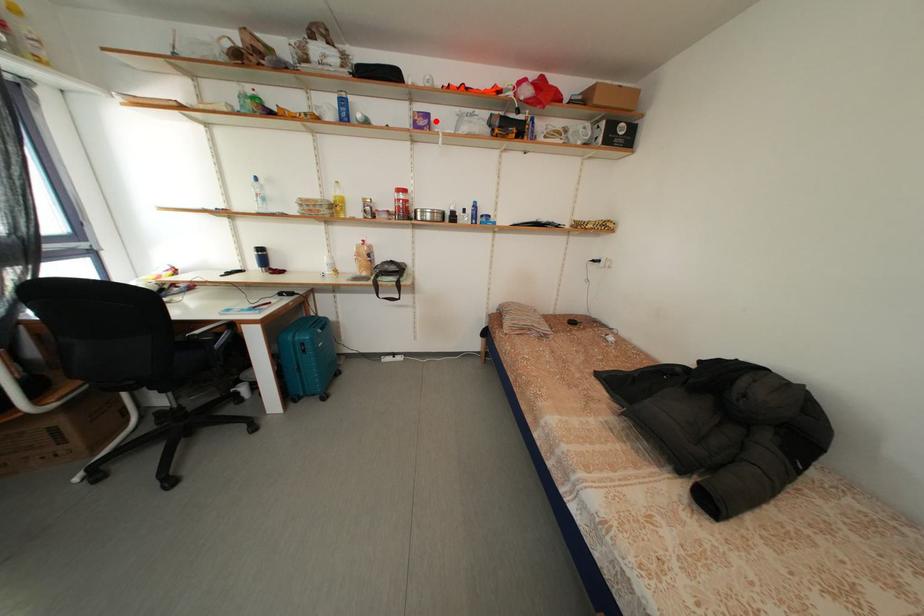
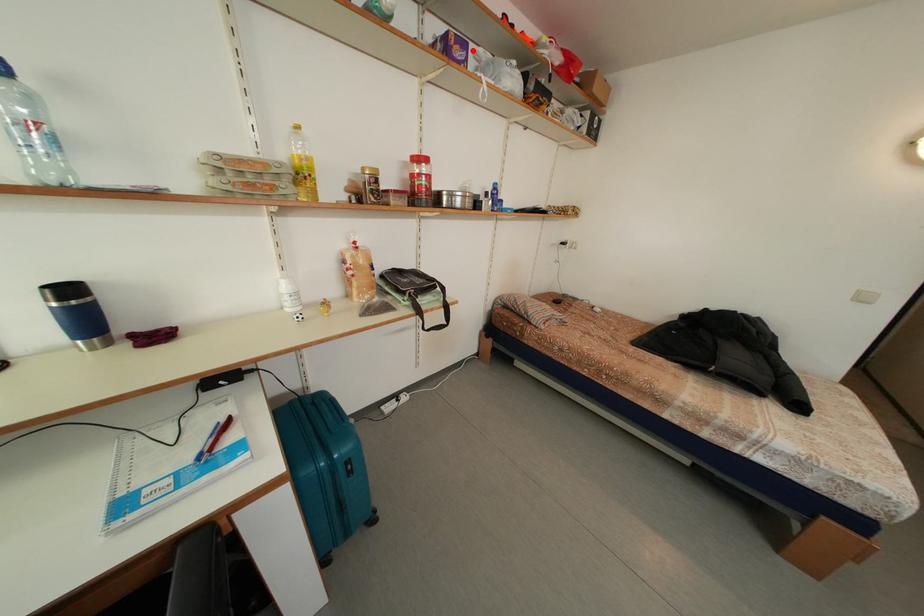
I am providing you with two images of the same scene from different viewpoints. A red point is marked on the first image and another point is marked on the second image. Is the marked point in image1 the same physical position as the marked point in image2?

Yes